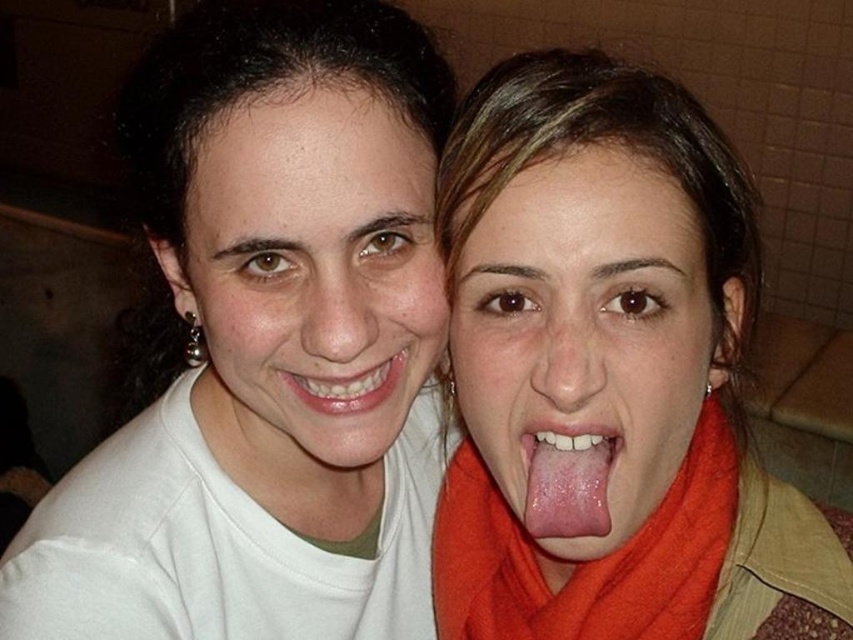
Question: Which object is positioned closest to the white matte shirt at upper left?

Choices:
 (A) matte white face at center
 (B) pink glossy tongue at center
 (C) matte white teeth at center
 (D) orange fabric scarf at center

Answer: (A)

Question: Does white matte shirt at upper left appear on the right side of matte white teeth at center?

Choices:
 (A) no
 (B) yes

Answer: (A)

Question: Among these objects, which one is nearest to the camera?

Choices:
 (A) matte white face at center
 (B) matte orange scarf at center
 (C) matte white teeth at center

Answer: (B)

Question: Does white matte shirt at upper left appear on the left side of matte white teeth at center?

Choices:
 (A) no
 (B) yes

Answer: (B)

Question: In this image, where is white matte shirt at upper left located relative to orange fabric scarf at center?

Choices:
 (A) above
 (B) below

Answer: (A)

Question: Which object is the closest to the matte white face at center?

Choices:
 (A) matte orange scarf at center
 (B) pink glossy tongue at center

Answer: (A)